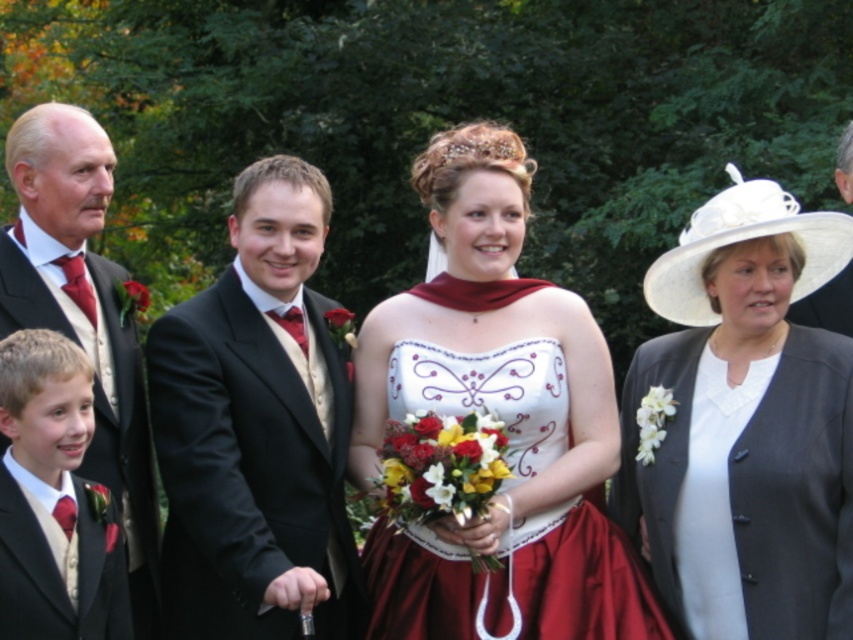
Question: Among these objects, which one is farthest from the camera?

Choices:
 (A) white satin dress at center
 (B) matte black suit at lower left
 (C) matte black suit at left

Answer: (A)

Question: Which of the following is the farthest from the observer?

Choices:
 (A) (717, 490)
 (B) (846, 282)
 (C) (59, 605)

Answer: (B)

Question: Is matte black suit at center positioned at the back of matte black suit at right?

Choices:
 (A) yes
 (B) no

Answer: (B)

Question: Is matte black suit at left positioned behind matte black suit at lower left?

Choices:
 (A) yes
 (B) no

Answer: (A)

Question: Does matte black suit at left have a greater width compared to matte black suit at lower left?

Choices:
 (A) no
 (B) yes

Answer: (B)

Question: Which point is closer to the camera?

Choices:
 (A) (49, 225)
 (B) (410, 412)
 (C) (840, 179)
 (D) (764, 292)

Answer: (D)